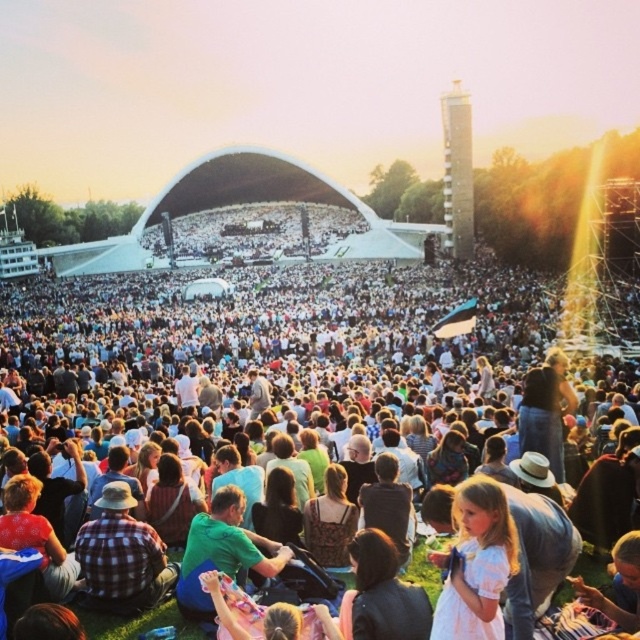
You are a photographer at the concert and want to capture both the matte white tent at upper center and the plaid fabric shirt at center in a single shot. Which object should you focus on first to ensure both are in frame?

You should focus on the matte white tent at upper center first since it is larger in size compared to the plaid fabric shirt at center, allowing the smaller object to naturally fit into the frame.

You are at the concert and see a person wearing a white cotton dress at center and a denim jacket at lower right. Which clothing item is positioned more to the left?

The white cotton dress at center is positioned to the left of the denim jacket at lower right, so the white cotton dress at center is more to the left.

You are at an outdoor concert and want to find a shaded area. You notice the matte white tent at upper center and the plaid fabric shirt at center. Which object is positioned to the left of the other?

The matte white tent at upper center is to the left of the plaid fabric shirt at center according to the description.